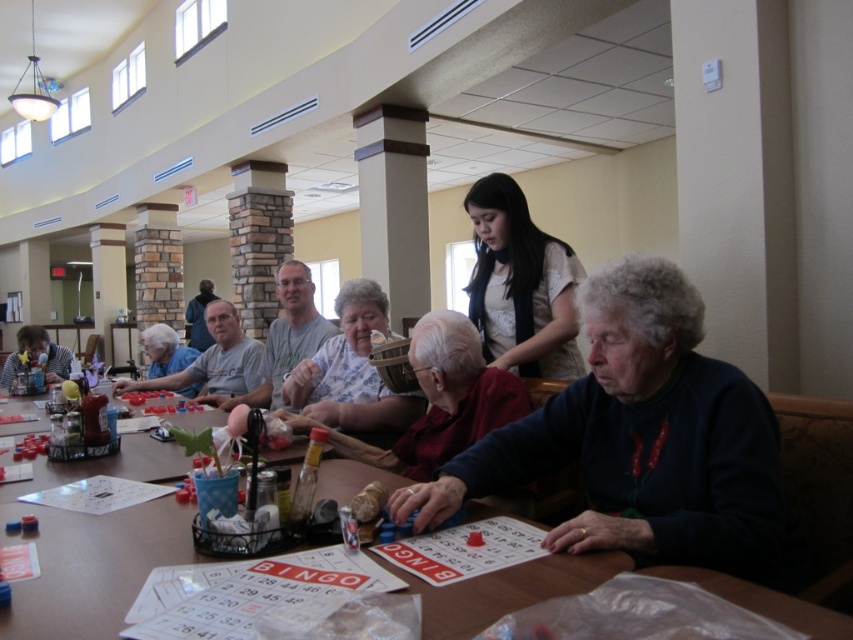
Can you confirm if floral fabric basket at center is thinner than matte plastic cup at lower left?

Correct, floral fabric basket at center's width is less than matte plastic cup at lower left's.

Is point (329, 362) in front of point (33, 333)?

That is True.

The height and width of the screenshot is (640, 853). What are the coordinates of `floral fabric basket at center` in the screenshot? It's located at (351, 371).

Between wooden table at center and matte black shirt at upper center, which one has more height?

Standing taller between the two is matte black shirt at upper center.

Which is in front, point (753, 609) or point (196, 317)?

Point (753, 609)

Find the location of `wooden table at center`. wooden table at center is located at coordinates (93, 548).

Looking at this image, between floral fabric shirt at center and matte plastic cup at lower left, which one is positioned lower?

matte plastic cup at lower left is lower down.

Who is positioned more to the right, floral fabric shirt at center or matte plastic cup at lower left?

floral fabric shirt at center

This screenshot has height=640, width=853. Describe the element at coordinates (445, 400) in the screenshot. I see `floral fabric shirt at center` at that location.

You are a GUI agent. You are given a task and a screenshot of the screen. Output one action in this format:
    pyautogui.click(x=<x>, y=<y>)
    Task: Click on the floral fabric shirt at center
    The image size is (853, 640).
    Given the screenshot: What is the action you would take?
    pyautogui.click(x=445, y=400)